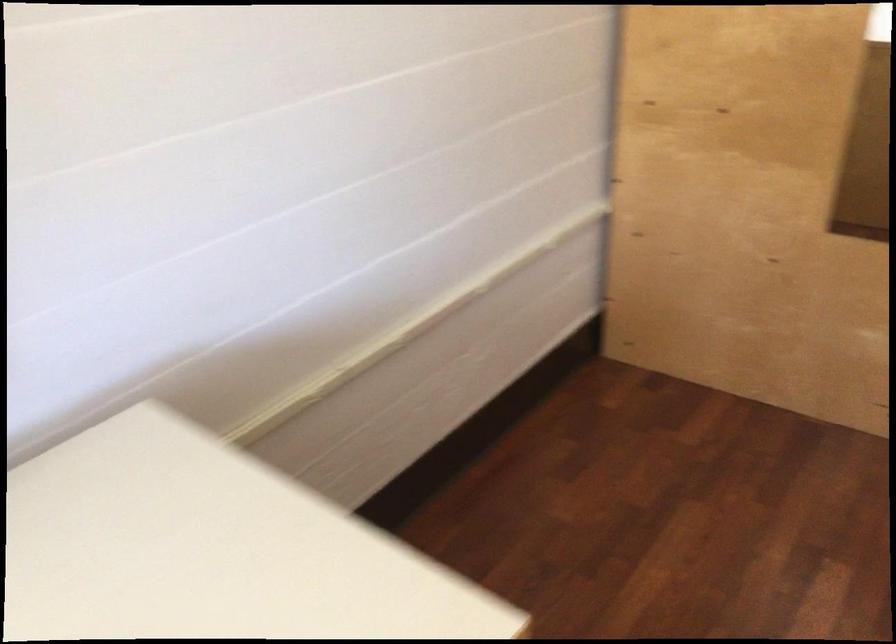
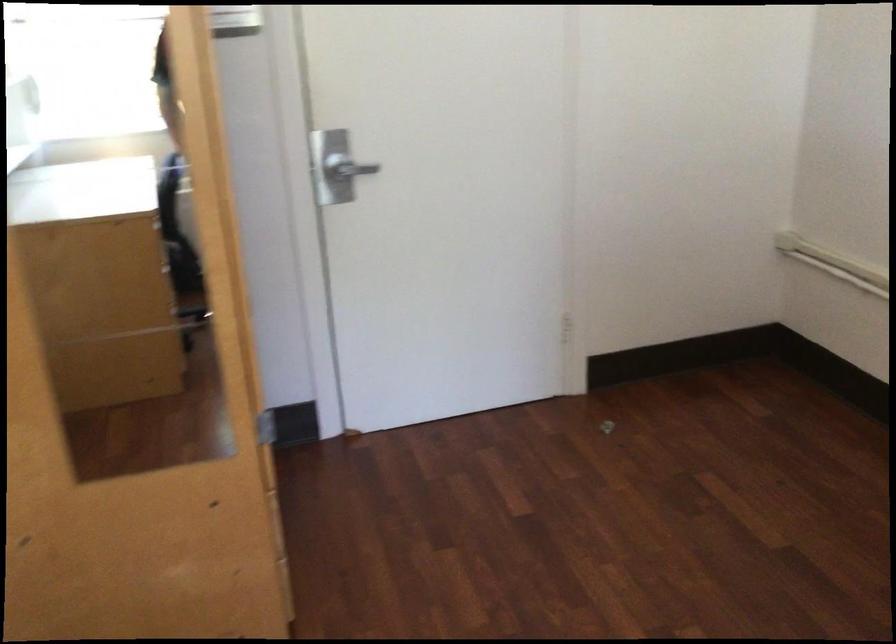
Question: The first image is from the beginning of the video and the second image is from the end. How did the camera likely rotate when shooting the video?

Choices:
 (A) Left
 (B) Right
 (C) Up
 (D) Down

Answer: (B)